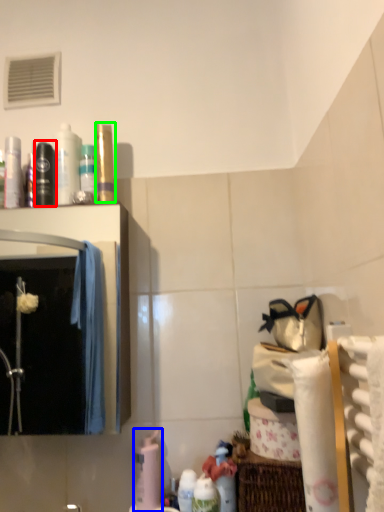
Question: Estimate the real-world distances between objects in this image. Which object is closer to mouthwash (highlighted by a red box), cleaning product (highlighted by a blue box) or toiletry (highlighted by a green box)?

Choices:
 (A) cleaning product
 (B) toiletry

Answer: (B)